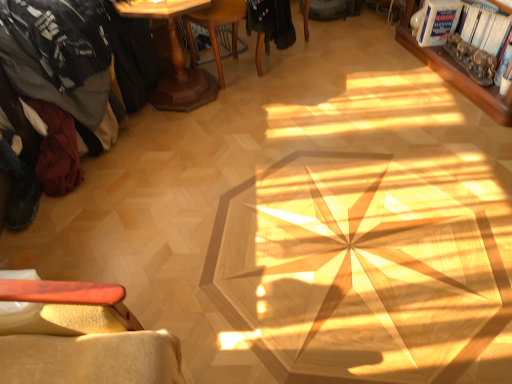
Question: From the image's perspective, would you say metallic silver magazine at upper right, which appears as the first magazine when ordered from the bottom, is positioned over wooden pedestal table at upper left?

Choices:
 (A) yes
 (B) no

Answer: (B)

Question: Is the surface of metallic silver magazine at upper right, which appears as the first magazine when ordered from the bottom, in direct contact with wooden pedestal table at upper left?

Choices:
 (A) no
 (B) yes

Answer: (A)

Question: Considering the relative sizes of metallic silver magazine at upper right, the second magazine viewed from the top, and wooden pedestal table at upper left in the image provided, is metallic silver magazine at upper right, the second magazine viewed from the top, thinner than wooden pedestal table at upper left?

Choices:
 (A) no
 (B) yes

Answer: (B)

Question: Is metallic silver magazine at upper right, which appears as the first magazine when ordered from the bottom, further to camera compared to wooden pedestal table at upper left?

Choices:
 (A) no
 (B) yes

Answer: (B)

Question: Does metallic silver magazine at upper right, the second magazine viewed from the top, have a smaller size compared to wooden pedestal table at upper left?

Choices:
 (A) yes
 (B) no

Answer: (A)

Question: Visually, is white glossy magazine at upper right, positioned as the 1th magazine in top-to-bottom order, positioned to the left or to the right of black fabric chair at center, arranged as the first chair when viewed from the right?

Choices:
 (A) right
 (B) left

Answer: (A)

Question: Is point (445, 6) positioned closer to the camera than point (256, 16)?

Choices:
 (A) farther
 (B) closer

Answer: (A)

Question: Considering the positions of white glossy magazine at upper right, which is the 2th magazine from bottom to top, and black fabric chair at center, positioned as the 2th chair in left-to-right order, in the image, is white glossy magazine at upper right, which is the 2th magazine from bottom to top, bigger or smaller than black fabric chair at center, positioned as the 2th chair in left-to-right order,?

Choices:
 (A) big
 (B) small

Answer: (B)

Question: Choose the correct answer: Is white glossy magazine at upper right, positioned as the 1th magazine in top-to-bottom order, inside black fabric chair at center, arranged as the first chair when viewed from the right, or outside it?

Choices:
 (A) outside
 (B) inside

Answer: (A)

Question: From the image's perspective, is wooden at center, the second chair when ordered from right to left, above or below wooden bookshelf at upper right?

Choices:
 (A) below
 (B) above

Answer: (A)

Question: From a real-world perspective, relative to wooden bookshelf at upper right, is wooden at center, the second chair when ordered from right to left, vertically above or below?

Choices:
 (A) above
 (B) below

Answer: (A)

Question: Considering the positions of wooden at center, the 1th chair in the left-to-right sequence, and wooden bookshelf at upper right in the image, is wooden at center, the 1th chair in the left-to-right sequence, wider or thinner than wooden bookshelf at upper right?

Choices:
 (A) thin
 (B) wide

Answer: (B)

Question: Would you say wooden at center, the 1th chair in the left-to-right sequence, is inside or outside wooden bookshelf at upper right?

Choices:
 (A) inside
 (B) outside

Answer: (B)

Question: Does point (172, 82) appear closer or farther from the camera than point (473, 79)?

Choices:
 (A) farther
 (B) closer

Answer: (A)

Question: Is wooden pedestal table at upper left in front of or behind metallic silver magazine at upper right, which appears as the first magazine when ordered from the bottom, in the image?

Choices:
 (A) behind
 (B) front

Answer: (B)